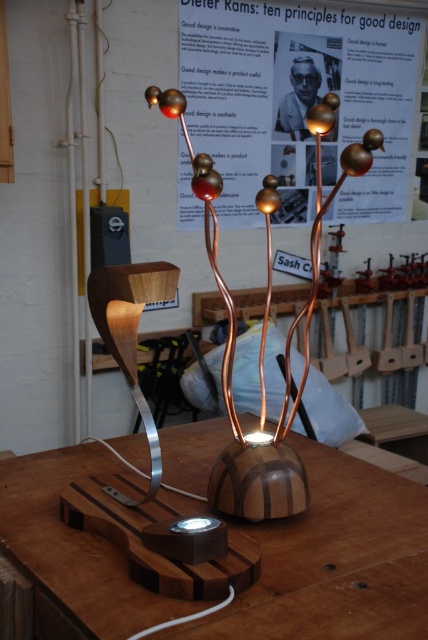
You are an interior designer assessing the placement of the metallic poster at upper center and the wooden table lamp at center in a studio. Which object is positioned higher in the scene?

The metallic poster at upper center is positioned higher than the wooden table lamp at center.

You are an interior designer who wants to ensure the wooden table lamp at center is visible from the entrance. Since the metallic poster at upper center is in the way, can you confirm if the lamp is placed behind the poster or in front of it?

The wooden table lamp at center is behind the metallic poster at upper center, so it might not be fully visible from the entrance.

You are standing in the workshop and want to place a small plant on the wooden table at center. However, there is already a wooden table lamp at center on it. Can you place the plant on the table without moving the lamp?

The wooden table at center is in front of the wooden table lamp at center, which means the lamp is behind the table. Therefore, the table has enough space to place the plant without moving the lamp.